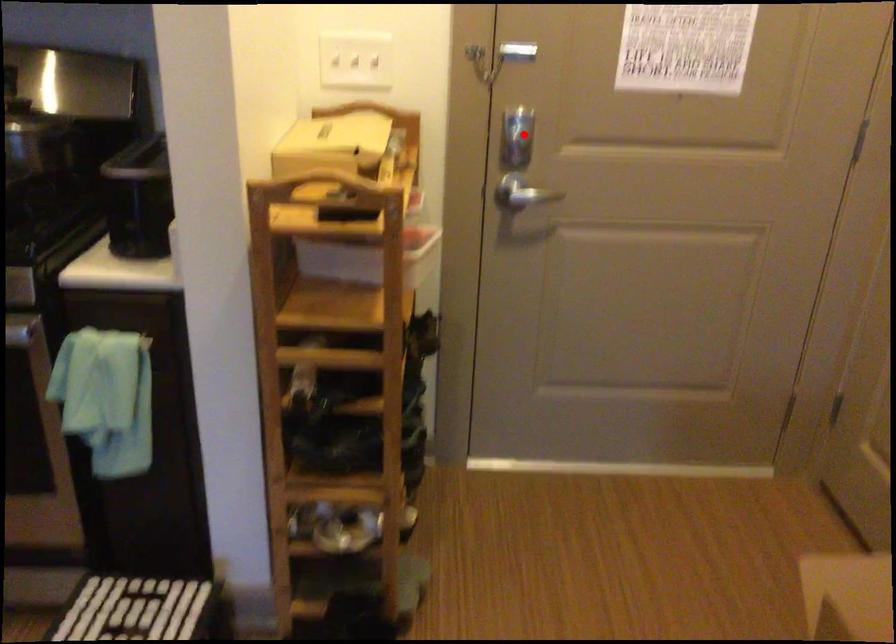
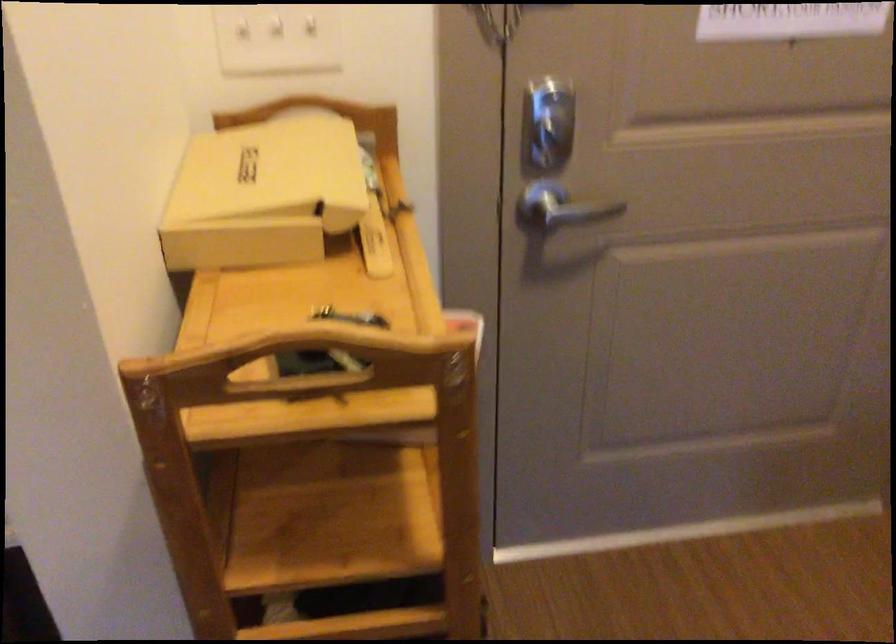
The point at the highlighted location is marked in the first image. Where is the corresponding point in the second image?

(547, 122)